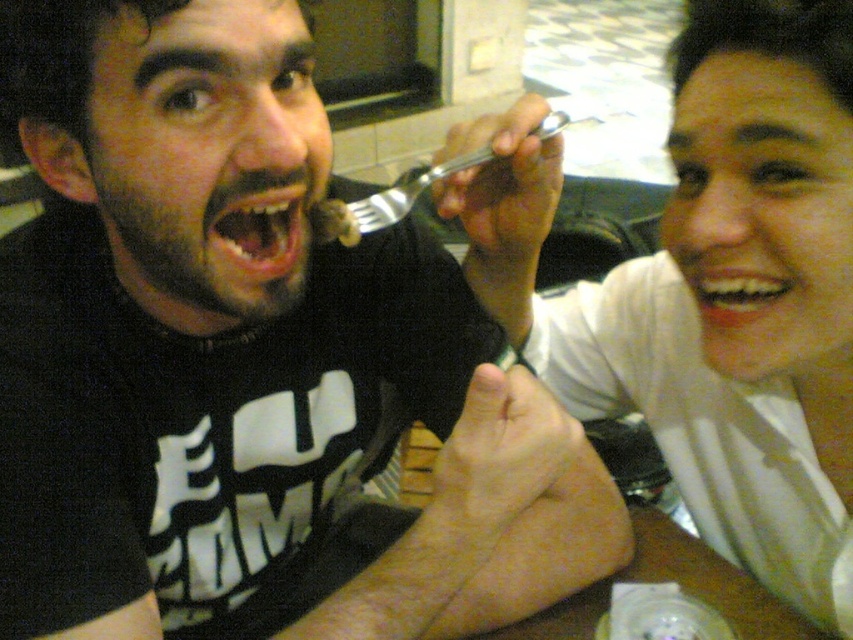
Who is more forward, (601,586) or (550,134)?

Positioned in front is point (550,134).

Who is more distant from viewer, (740,602) or (422,186)?

The point (740,602) is behind.

Between point (624, 572) and point (445, 173), which one is positioned in front?

Positioned in front is point (445, 173).

Identify the location of wooden table at lower center. (674, 580).

Who is more distant from viewer, (x=22, y=250) or (x=345, y=227)?

The point (x=22, y=250) is more distant.

Does matte black fork at upper center appear over matte plastic fork at upper center?

No, matte black fork at upper center is not above matte plastic fork at upper center.

Which is behind, point (86, 502) or point (332, 205)?

Positioned behind is point (332, 205).

Locate an element on the screen. The image size is (853, 640). matte black fork at upper center is located at coordinates (242, 360).

Based on the photo, can you confirm if white matte fork at upper right is positioned above wooden table at lower center?

Indeed, white matte fork at upper right is positioned over wooden table at lower center.

Can you confirm if white matte fork at upper right is positioned below wooden table at lower center?

Actually, white matte fork at upper right is above wooden table at lower center.

Is point (676, 250) less distant than point (721, 596)?

That is True.

You are a GUI agent. You are given a task and a screenshot of the screen. Output one action in this format:
    pyautogui.click(x=<x>, y=<y>)
    Task: Click on the white matte fork at upper right
    Image resolution: width=853 pixels, height=640 pixels.
    Given the screenshot: What is the action you would take?
    pyautogui.click(x=694, y=296)